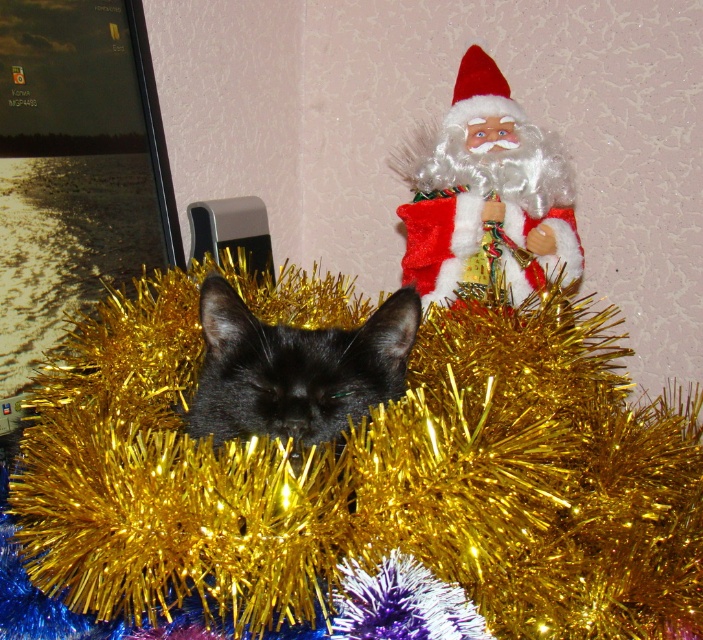
Question: Does gold tinsel at center lie behind black shiny cat at center?

Choices:
 (A) yes
 (B) no

Answer: (B)

Question: Which of the following is the closest to the observer?

Choices:
 (A) (479, 360)
 (B) (419, 241)
 (C) (269, 381)

Answer: (C)

Question: Is gold tinsel at center further to camera compared to black shiny cat at center?

Choices:
 (A) yes
 (B) no

Answer: (B)

Question: Is gold tinsel at center above fuzzy white santa at upper right?

Choices:
 (A) no
 (B) yes

Answer: (A)

Question: Which of the following is the closest to the observer?

Choices:
 (A) fuzzy white santa at upper right
 (B) gold tinsel at center

Answer: (B)

Question: Which point appears farthest from the camera in this image?

Choices:
 (A) (423, 253)
 (B) (245, 433)

Answer: (A)